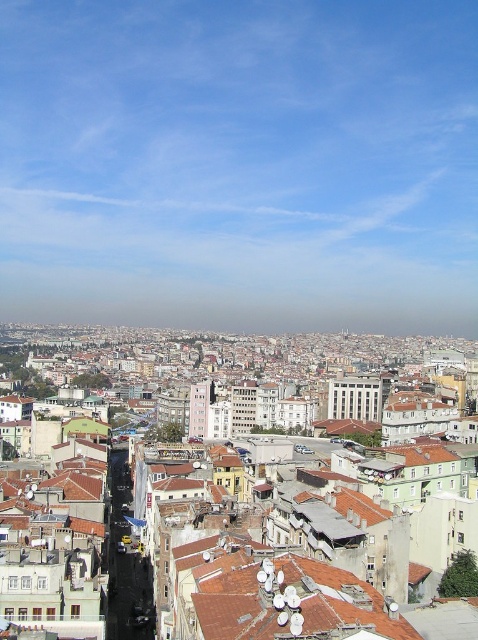
You are standing in the urban area shown in the image. You see two points marked as point 1 at coordinates point (379, 420) and point 2 at coordinates point (192, 401). Which point is closer to you?

Point (379, 420) is in front of point (192, 401), so point (379, 420) is closer to you.

You are an urban planner reviewing this cityscape. You notice the white concrete building at center and the pink concrete building at center. Which one has a lower height?

The white concrete building at center is not as tall as the pink concrete building at center, so the white concrete building at center is shorter.

You are a city planner analyzing this urban area. You notice the brown tile roof at center and the white concrete building at center. Based on their positions, which one is closer to the ground?

The brown tile roof at center is below the white concrete building at center, so it is closer to the ground.